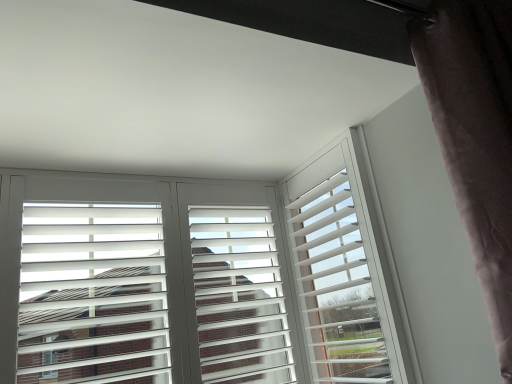
Question: Does white matte window frame at center contain dark velvet curtain at right?

Choices:
 (A) yes
 (B) no

Answer: (B)

Question: Is white matte window frame at center to the right of dark velvet curtain at right from the viewer's perspective?

Choices:
 (A) no
 (B) yes

Answer: (A)

Question: Is white matte window frame at center closer to camera compared to dark velvet curtain at right?

Choices:
 (A) yes
 (B) no

Answer: (B)

Question: From a real-world perspective, is white matte window frame at center below dark velvet curtain at right?

Choices:
 (A) yes
 (B) no

Answer: (A)

Question: Is white matte window frame at center taller than dark velvet curtain at right?

Choices:
 (A) no
 (B) yes

Answer: (A)

Question: Considering the relative sizes of white matte window frame at center and dark velvet curtain at right in the image provided, is white matte window frame at center smaller than dark velvet curtain at right?

Choices:
 (A) no
 (B) yes

Answer: (B)

Question: From the image's perspective, is dark velvet curtain at right located above white matte shutters at center?

Choices:
 (A) no
 (B) yes

Answer: (B)

Question: Is dark velvet curtain at right positioned in front of white matte shutters at center?

Choices:
 (A) yes
 (B) no

Answer: (A)

Question: Does dark velvet curtain at right appear on the right side of white matte shutters at center?

Choices:
 (A) no
 (B) yes

Answer: (B)

Question: Considering the relative sizes of dark velvet curtain at right and white matte shutters at center in the image provided, is dark velvet curtain at right taller than white matte shutters at center?

Choices:
 (A) no
 (B) yes

Answer: (B)

Question: Can you confirm if dark velvet curtain at right is bigger than white matte shutters at center?

Choices:
 (A) no
 (B) yes

Answer: (B)

Question: Are dark velvet curtain at right and white matte shutters at center beside each other?

Choices:
 (A) yes
 (B) no

Answer: (B)

Question: Is dark velvet curtain at right not close to white matte window frame at center?

Choices:
 (A) no
 (B) yes

Answer: (A)